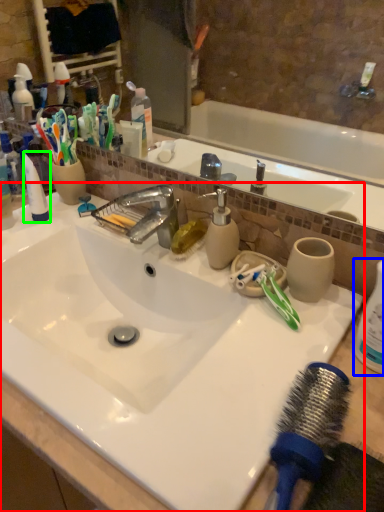
Question: Considering the real-world distances, which object is closest to sink (highlighted by a red box)? cleaning product (highlighted by a blue box) or toothpaste (highlighted by a green box).

Choices:
 (A) cleaning product
 (B) toothpaste

Answer: (B)